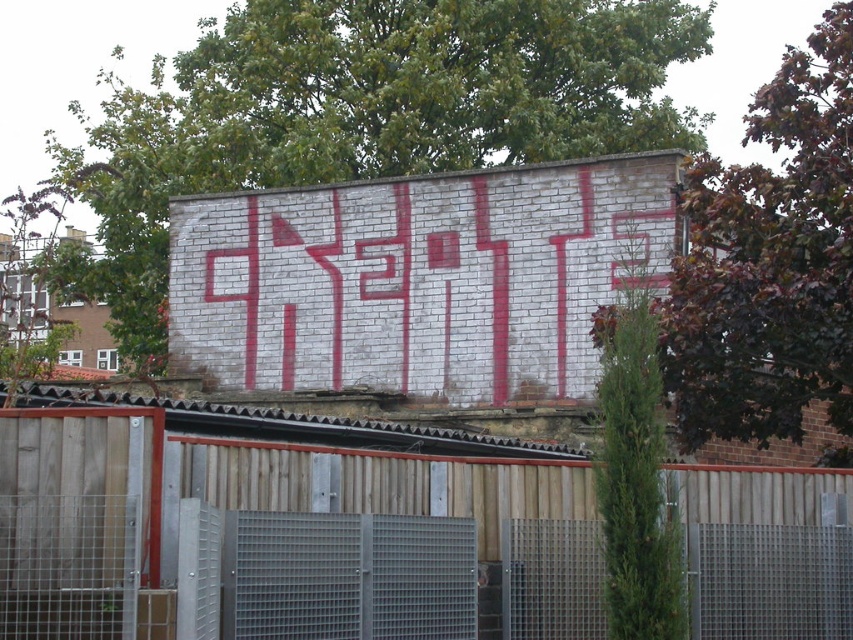
You are standing in front of the white brick wall at center and the wooden fence at center. Which object is located to the right side of the other?

The wooden fence at center is located to the right side of the white brick wall at center because the white brick wall at center is positioned on the left side of the wooden fence at center.

You are standing in a city park and see the white brick wall at center. If you want to take a photo of it from where you are standing, will the wall fit entirely within the frame of a standard smartphone camera with a 78.97 degree field of view?

The white brick wall at center is 38.97 meters away from the viewer. Using the formula for field of view, the maximum distance at which the wall can be fully framed is calculated. Since the distance is within the smartphone camera field of view, the wall will fit entirely within the frame.

You are standing in front of the brick wall with the graffiti. There are two points marked on the ground in front of you. One is at coordinate point(381, 291) and the other is at point(390, 483). If you want to walk towards the wall, which point should you step on first?

You should step on point(390, 483) first because it is closer to you than point(381, 291), which is behind it.